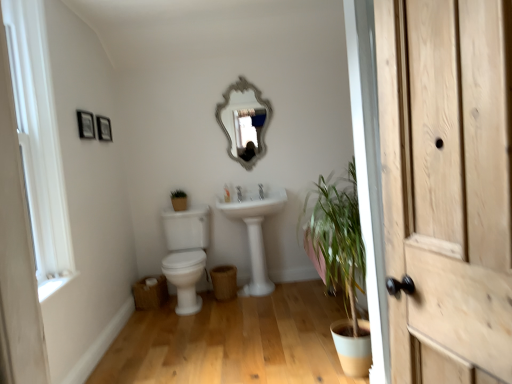
The image size is (512, 384). I want to click on free location in front of white glossy sink at center, so click(260, 316).